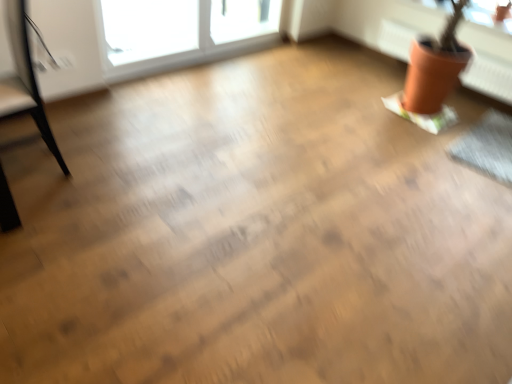
Question: Is black leather armchair at left positioned in front of terracotta clay pot at upper right?

Choices:
 (A) no
 (B) yes

Answer: (B)

Question: Is black leather armchair at left facing away from terracotta clay pot at upper right?

Choices:
 (A) no
 (B) yes

Answer: (B)

Question: Can you confirm if black leather armchair at left is thinner than terracotta clay pot at upper right?

Choices:
 (A) no
 (B) yes

Answer: (A)

Question: Is black leather armchair at left further to camera compared to terracotta clay pot at upper right?

Choices:
 (A) no
 (B) yes

Answer: (A)

Question: Can you confirm if black leather armchair at left is bigger than terracotta clay pot at upper right?

Choices:
 (A) no
 (B) yes

Answer: (B)

Question: Considering their positions, is transparent glass window screen at upper right located in front of or behind black leather armchair at left?

Choices:
 (A) front
 (B) behind

Answer: (B)

Question: Does point (504, 8) appear closer or farther from the camera than point (19, 38)?

Choices:
 (A) farther
 (B) closer

Answer: (A)

Question: From a real-world perspective, is transparent glass window screen at upper right above or below black leather armchair at left?

Choices:
 (A) above
 (B) below

Answer: (A)

Question: In terms of width, does transparent glass window screen at upper right look wider or thinner when compared to black leather armchair at left?

Choices:
 (A) wide
 (B) thin

Answer: (B)

Question: Is terracotta clay pot at upper right in front of or behind black leather armchair at left in the image?

Choices:
 (A) behind
 (B) front

Answer: (A)

Question: Based on their positions, is terracotta clay pot at upper right located to the left or right of black leather armchair at left?

Choices:
 (A) left
 (B) right

Answer: (B)

Question: Considering the positions of point (498, 61) and point (41, 124), is point (498, 61) closer or farther from the camera than point (41, 124)?

Choices:
 (A) closer
 (B) farther

Answer: (B)

Question: Which is correct: terracotta clay pot at upper right is inside black leather armchair at left, or outside of it?

Choices:
 (A) outside
 (B) inside

Answer: (A)

Question: From the image's perspective, is terracotta clay pot at upper right positioned above or below transparent glass window screen at upper right?

Choices:
 (A) below
 (B) above

Answer: (A)

Question: From a real-world perspective, is terracotta clay pot at upper right positioned above or below transparent glass window screen at upper right?

Choices:
 (A) above
 (B) below

Answer: (B)